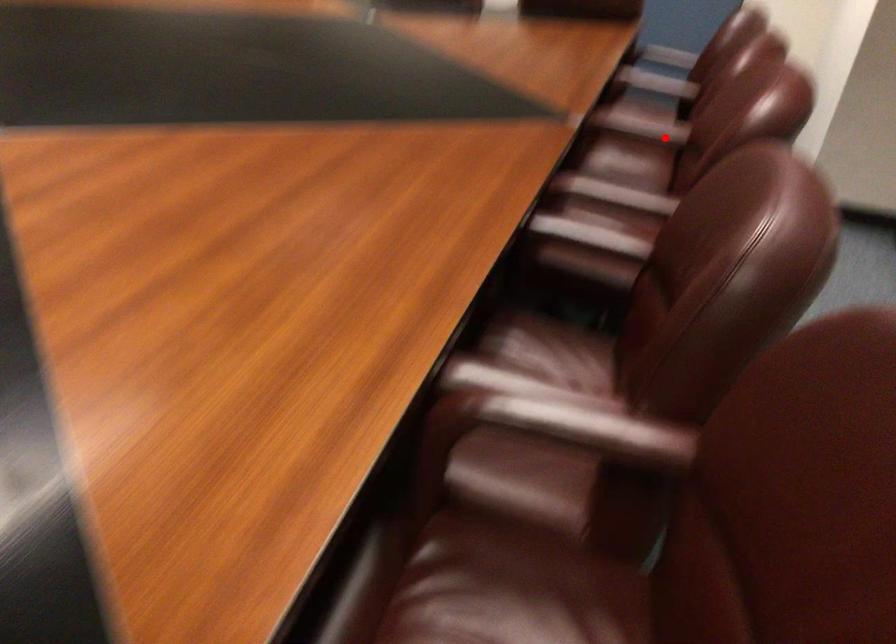
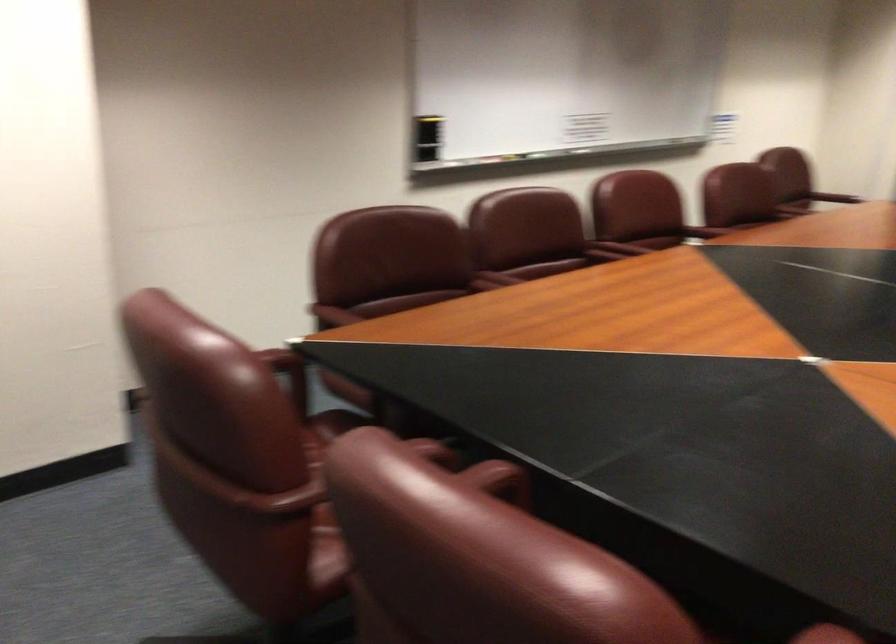
Question: I am providing you with two images of the same scene from different viewpoints. Image1 has a red point marked. In image2, the corresponding 3D location appears at what relative position? Reply with the corresponding letter.

Choices:
 (A) Closer
 (B) Farther

Answer: (B)